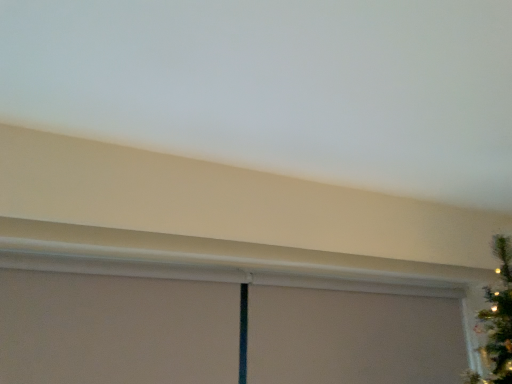
Question: Should I look upward or downward to see matte white window screen at lower center?

Choices:
 (A) up
 (B) down

Answer: (B)